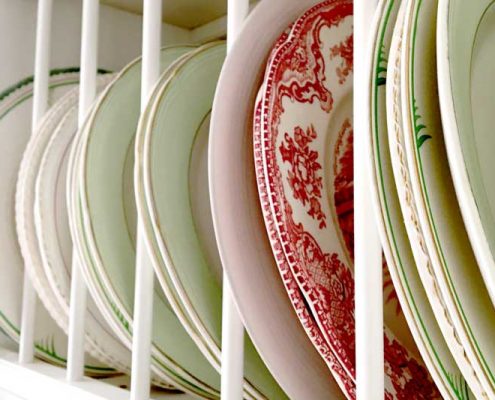
Find the location of a particular element. cabinet dividers is located at coordinates 24,343, 75,352, 141,364, 229,367, 372,363.